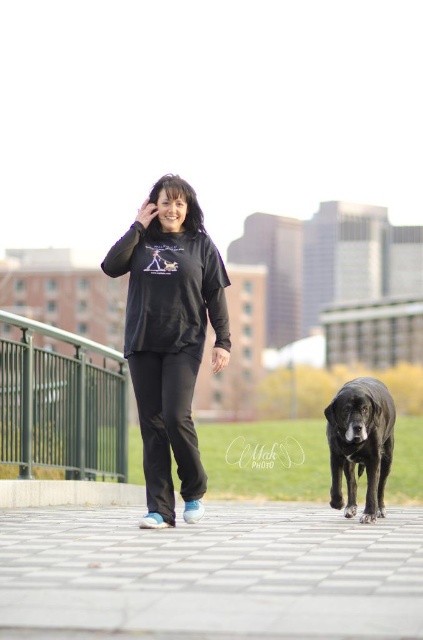
You are standing at point (167, 243) and want to take a photo of the woman and her black dog. The camera you have can focus on subjects within 10 meters. Will the camera be able to focus on them?

The distance between point (167, 243) and the camera is 10.70 meters, which is beyond the camera focus range of 10 meters. Therefore, the camera cannot focus on them.

You are the woman in the image holding the black dog. You want to walk towards the point at coordinates point (156, 214) and point (335, 413). Which point should you reach first?

Point (156, 214) is in front of point (335, 413), so you should reach point (156, 214) first.

From the picture: You are standing at the camera position and want to throw a frisbee to a friend who is at point [200,253]. The frisbee can travel up to 12 meters. Will it reach them?

The distance between you and point [200,253] is 10.74 meters, which is within the frisbee travel limit of 12 meters. Yes, the frisbee will reach them.